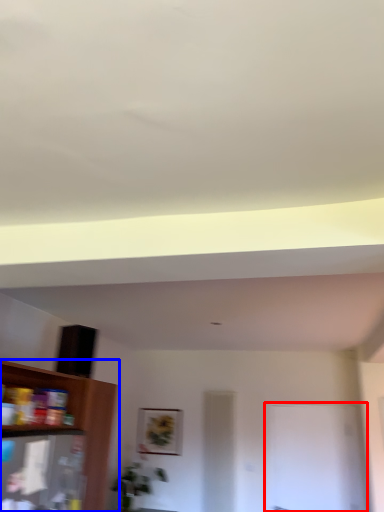
Question: Which point is closer to the camera, glass door (highlighted by a red box) or shelf (highlighted by a blue box)?

Choices:
 (A) glass door
 (B) shelf

Answer: (B)